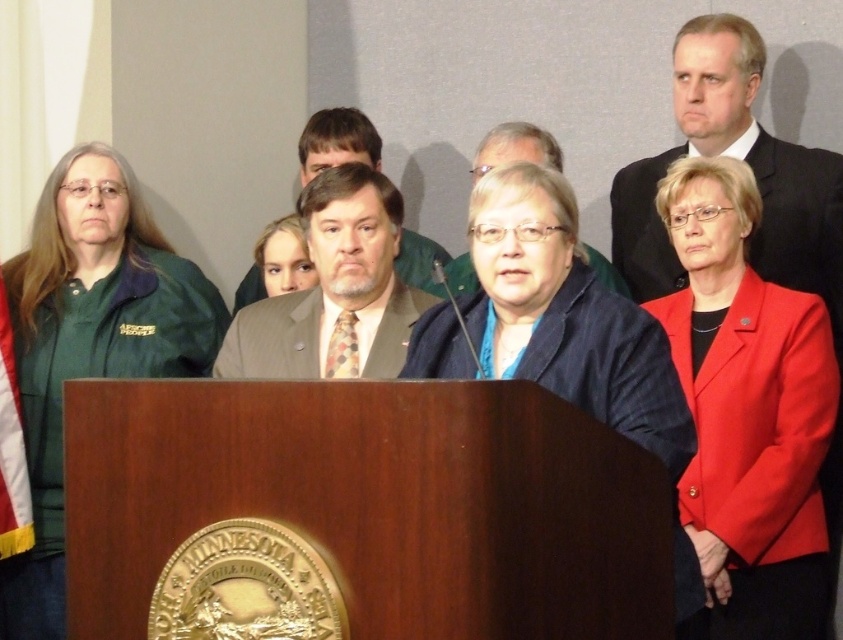
Question: Among these points, which one is nearest to the camera?

Choices:
 (A) (344, 145)
 (B) (785, 320)
 (C) (600, 275)

Answer: (B)

Question: Is green fabric jacket at left bigger than matte brown suit at center?

Choices:
 (A) no
 (B) yes

Answer: (B)

Question: Among these points, which one is farthest from the camera?

Choices:
 (A) (122, 316)
 (B) (765, 500)

Answer: (A)

Question: Does matte brown suit at center appear on the right side of light brown suit at center?

Choices:
 (A) no
 (B) yes

Answer: (A)

Question: Does green fabric jacket at left lie behind dark suit at upper right?

Choices:
 (A) no
 (B) yes

Answer: (A)

Question: Which of these objects is positioned closest to the matte brown suit at center?

Choices:
 (A) light brown suit at center
 (B) dark suit at upper right
 (C) blue fabric jacket at center
 (D) green fabric jacket at left

Answer: (A)